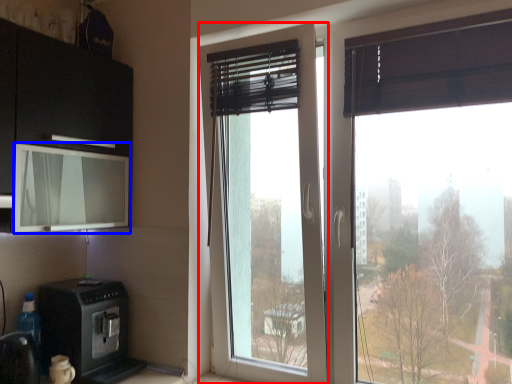
Question: Which object is further to the camera taking this photo, window (highlighted by a red box) or window screen (highlighted by a blue box)?

Choices:
 (A) window
 (B) window screen

Answer: (A)